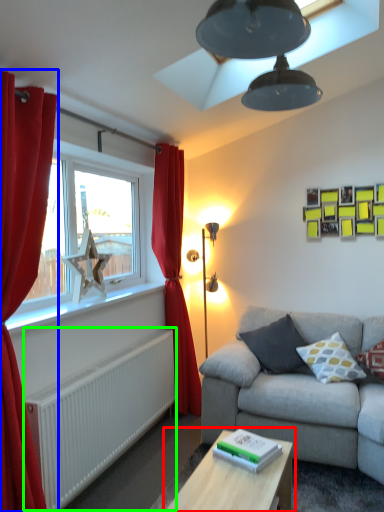
Question: Which object is positioned farthest from table (highlighted by a red box)? Select from curtain (highlighted by a blue box) and radiator (highlighted by a green box).

Choices:
 (A) curtain
 (B) radiator

Answer: (A)